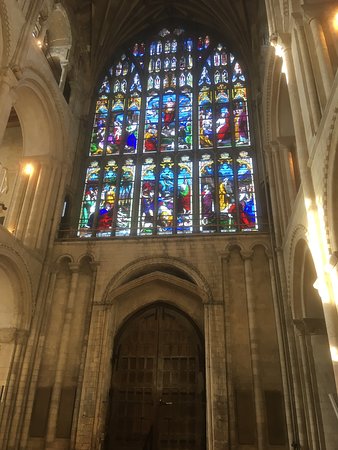
Identify the location of stained glass. (147, 202).